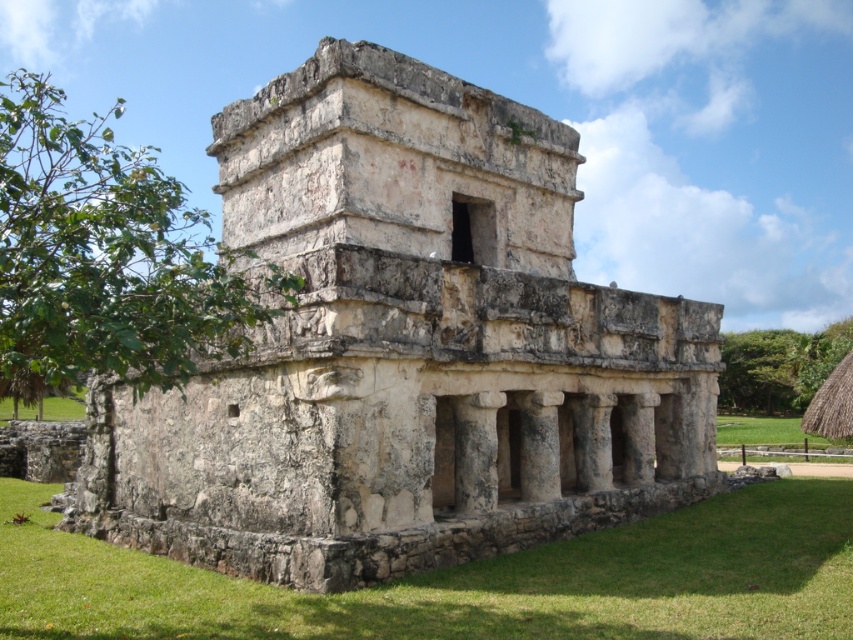
You are an archaeologist standing in front of the stone ruins at center and the green grass at lower right. Which object is positioned to the left of the other?

The stone ruins at center are to the left of green grass at lower right.

You are an archaeologist examining the ancient stone structure. You notice the stone ruins at center and the green grass at lower right. Based on their positions, which one is situated higher in elevation?

The stone ruins at center is located above green grass at lower right, so it is situated higher in elevation.